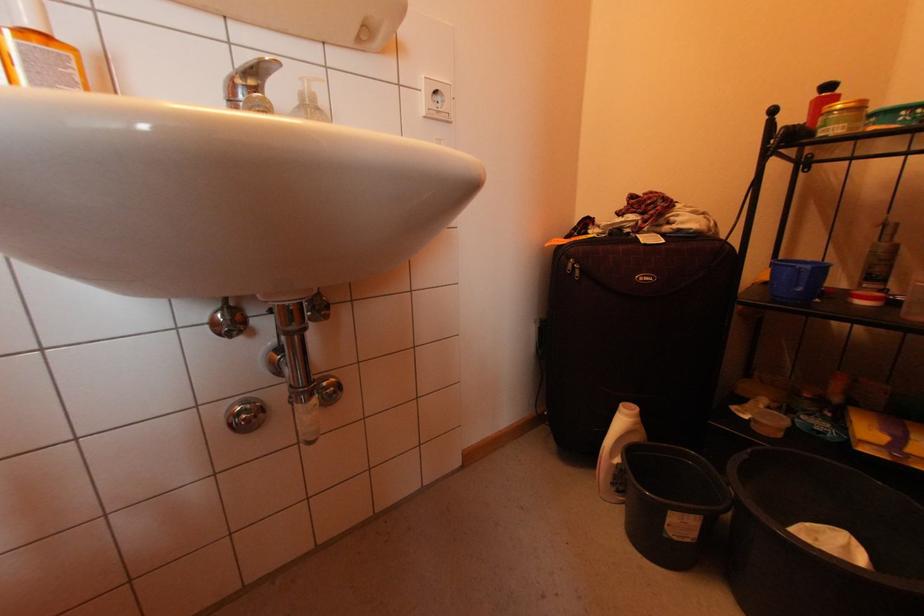
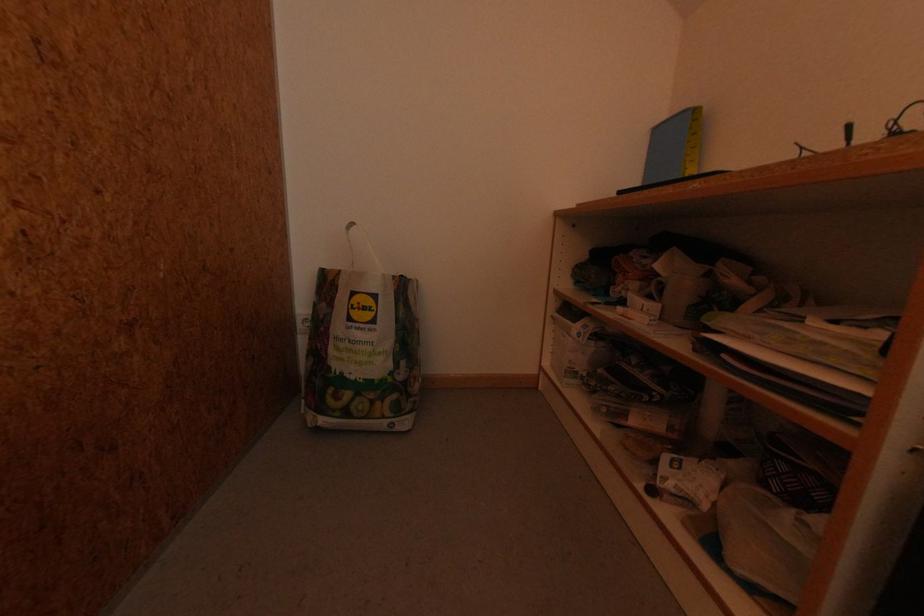
Question: The first image is from the beginning of the video and the second image is from the end. How did the camera likely rotate when shooting the video?

Choices:
 (A) Left
 (B) Right
 (C) Up
 (D) Down

Answer: (B)